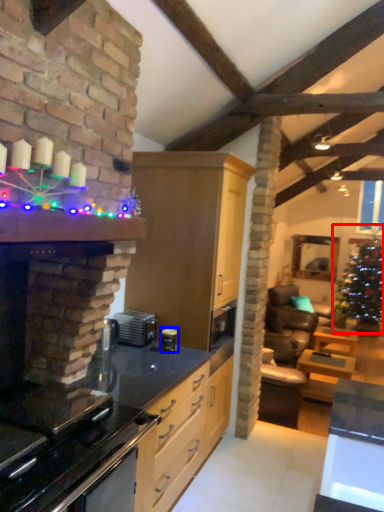
Question: Which object appears farthest to the camera in this image, christmas tree (highlighted by a red box) or appliance (highlighted by a blue box)?

Choices:
 (A) christmas tree
 (B) appliance

Answer: (A)